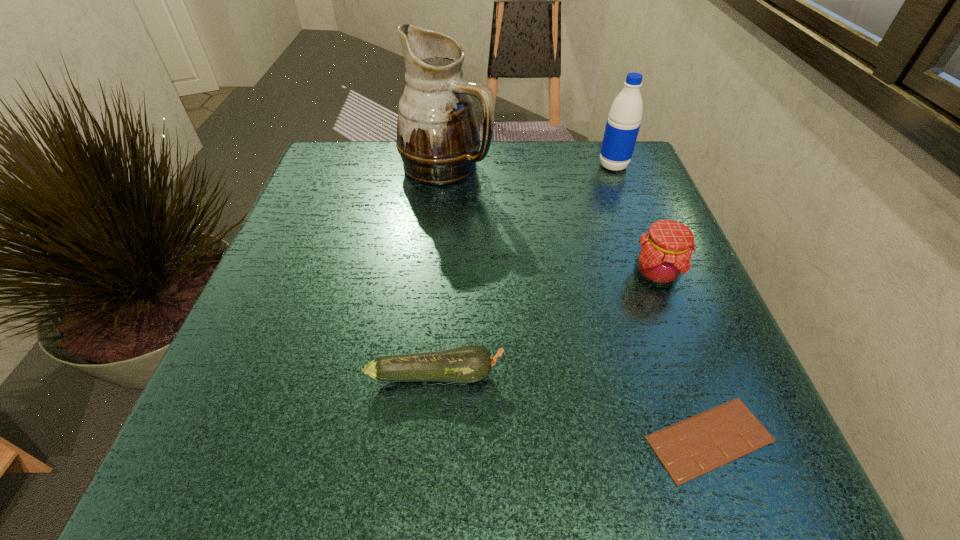
The height and width of the screenshot is (540, 960). In order to click on unoccupied position between the chocolate bar and the pitcher in this screenshot , I will do [578, 303].

You are a GUI agent. You are given a task and a screenshot of the screen. Output one action in this format:
    pyautogui.click(x=<x>, y=<y>)
    Task: Click on the vacant point located between the third farthest object and the chocolate bar
    The image size is (960, 540).
    Given the screenshot: What is the action you would take?
    pyautogui.click(x=683, y=357)

Where is `vacant point located between the water bottle and the chocolate bar`? vacant point located between the water bottle and the chocolate bar is located at coordinates (661, 302).

Identify the location of unoccupied area between the water bottle and the third farthest object. (635, 220).

Where is `free spot between the zucchini and the chocolate bar`? Image resolution: width=960 pixels, height=540 pixels. free spot between the zucchini and the chocolate bar is located at coordinates (573, 407).

I want to click on unoccupied position between the tallest object and the water bottle, so click(530, 166).

In order to click on vacant space that is in between the second shortest object and the pitcher in this screenshot , I will do `click(441, 270)`.

You are a GUI agent. You are given a task and a screenshot of the screen. Output one action in this format:
    pyautogui.click(x=<x>, y=<y>)
    Task: Click on the vacant space that is in between the pitcher and the zucchini
    
    Given the screenshot: What is the action you would take?
    pyautogui.click(x=441, y=270)

Identify the location of object that is the closest to the shortest object. (467, 364).

Choose which object is the third nearest neighbor to the pitcher. Please provide its 2D coordinates. Your answer should be formatted as a tuple, i.e. [(x, y)], where the tuple contains the x and y coordinates of a point satisfying the conditions above.

[(467, 364)]